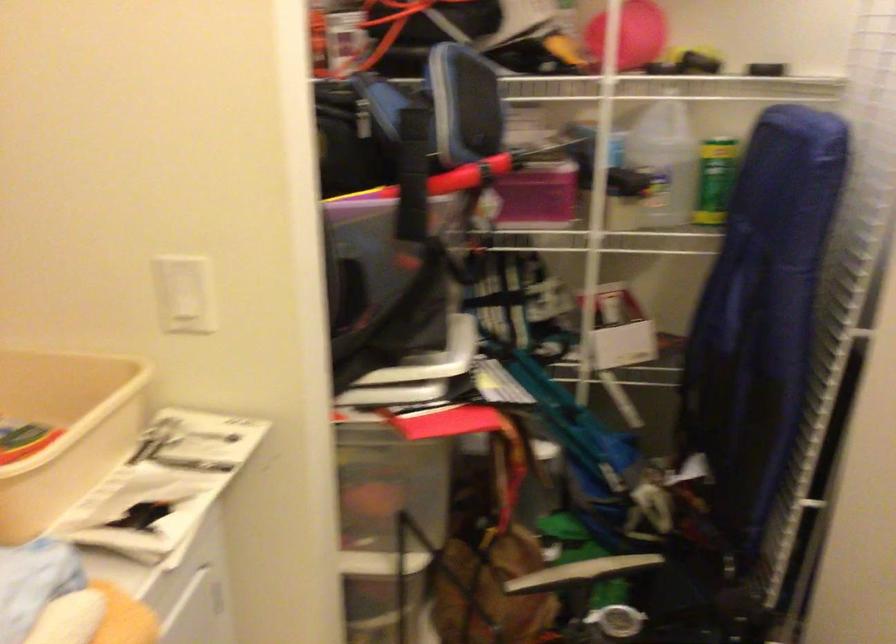
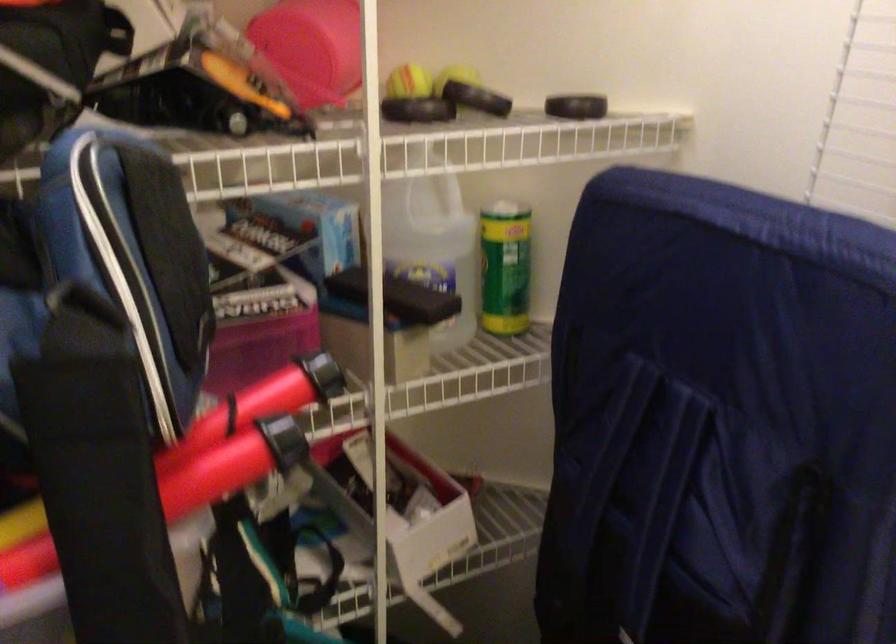
In the second image, find the point that corresponds to point (653, 151) in the first image.

(433, 243)